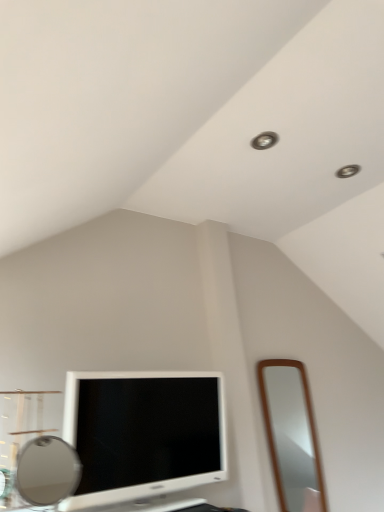
Question: Considering the relative sizes of white glossy television at lower left and brown wooden mirror at right, which is counted as the second mirror, starting from the front, in the image provided, is white glossy television at lower left wider than brown wooden mirror at right, which is counted as the second mirror, starting from the front,?

Choices:
 (A) no
 (B) yes

Answer: (B)

Question: Is white glossy television at lower left positioned behind brown wooden mirror at right, which appears as the 1th mirror when viewed from the right?

Choices:
 (A) yes
 (B) no

Answer: (B)

Question: Does white glossy television at lower left have a greater height compared to brown wooden mirror at right, which is counted as the second mirror, starting from the front?

Choices:
 (A) no
 (B) yes

Answer: (A)

Question: Does white glossy television at lower left have a larger size compared to brown wooden mirror at right, which is counted as the second mirror, starting from the front?

Choices:
 (A) no
 (B) yes

Answer: (B)

Question: From a real-world perspective, is white glossy television at lower left on brown wooden mirror at right, which appears as the 1th mirror when viewed from the right?

Choices:
 (A) no
 (B) yes

Answer: (B)

Question: Is point (28, 463) closer or farther from the camera than point (281, 380)?

Choices:
 (A) farther
 (B) closer

Answer: (B)

Question: Which is correct: matte silver mirror at lower left, which ranks as the second mirror in right-to-left order, is inside brown wooden mirror at right, which is counted as the second mirror, starting from the front, or outside of it?

Choices:
 (A) outside
 (B) inside

Answer: (A)

Question: From a real-world perspective, is matte silver mirror at lower left, which ranks as the second mirror in right-to-left order, positioned above or below brown wooden mirror at right, which is the second mirror from left to right?

Choices:
 (A) below
 (B) above

Answer: (A)

Question: Looking at the image, does matte silver mirror at lower left, which is counted as the first mirror, starting from the front, seem bigger or smaller compared to brown wooden mirror at right, acting as the first mirror starting from the back?

Choices:
 (A) big
 (B) small

Answer: (B)

Question: Considering the relative positions of brown wooden mirror at right, which is the second mirror from left to right, and white glossy television at lower left in the image provided, is brown wooden mirror at right, which is the second mirror from left to right, to the left or to the right of white glossy television at lower left?

Choices:
 (A) right
 (B) left

Answer: (A)

Question: From a real-world perspective, relative to white glossy television at lower left, is brown wooden mirror at right, which is the second mirror from left to right, vertically above or below?

Choices:
 (A) below
 (B) above

Answer: (A)

Question: From their relative heights in the image, would you say brown wooden mirror at right, which is counted as the second mirror, starting from the front, is taller or shorter than white glossy television at lower left?

Choices:
 (A) short
 (B) tall

Answer: (B)

Question: Do you think brown wooden mirror at right, which appears as the 1th mirror when viewed from the right, is within white glossy television at lower left, or outside of it?

Choices:
 (A) inside
 (B) outside

Answer: (B)

Question: From the image's perspective, is matte silver mirror at lower left, which is counted as the first mirror, starting from the front, located above or below white glossy television at lower left?

Choices:
 (A) below
 (B) above

Answer: (B)

Question: Which is correct: matte silver mirror at lower left, which ranks as the second mirror in right-to-left order, is inside white glossy television at lower left, or outside of it?

Choices:
 (A) inside
 (B) outside

Answer: (B)